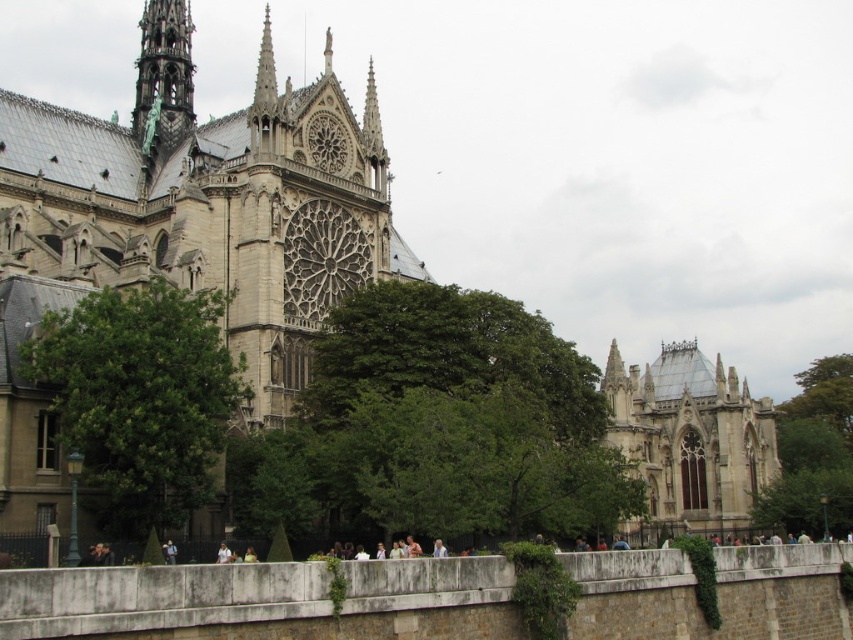
Question: Is green leafy tree at center thinner than light blue fabric at lower center?

Choices:
 (A) yes
 (B) no

Answer: (B)

Question: Is green leafy tree at center to the right of green leafy tree at left from the viewer's perspective?

Choices:
 (A) no
 (B) yes

Answer: (B)

Question: Which point is closer to the camera taking this photo?

Choices:
 (A) (779, 424)
 (B) (202, 461)
 (C) (434, 541)

Answer: (C)

Question: Which point appears closest to the camera in this image?

Choices:
 (A) (155, 8)
 (B) (844, 442)
 (C) (49, 349)

Answer: (C)

Question: Which point is closer to the camera?

Choices:
 (A) (229, 556)
 (B) (79, 396)
 (C) (167, 548)
 (D) (798, 435)

Answer: (B)

Question: Is green leafy tree at right to the right of light blue denim jacket at lower center from the viewer's perspective?

Choices:
 (A) no
 (B) yes

Answer: (B)